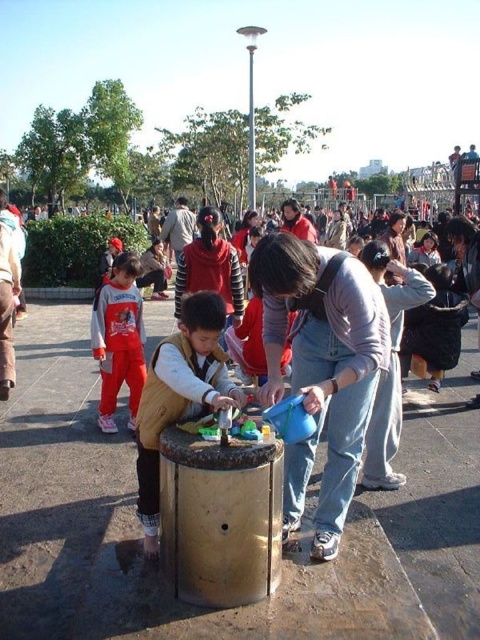
Question: Is matte gray sweater at center to the left of matte black jacket at center from the viewer's perspective?

Choices:
 (A) no
 (B) yes

Answer: (A)

Question: Is light brown vest at center closer to the viewer compared to matte red pants at center?

Choices:
 (A) no
 (B) yes

Answer: (B)

Question: Which point appears farthest from the camera in this image?

Choices:
 (A) click(325, 353)
 (B) click(213, 362)

Answer: (A)

Question: Which object is the closest to the light brown vest at center?

Choices:
 (A) matte black jacket at center
 (B) matte gray sweater at center

Answer: (B)

Question: Can you confirm if matte red pants at center is smaller than matte black jacket at center?

Choices:
 (A) no
 (B) yes

Answer: (B)

Question: Estimate the real-world distances between objects in this image. Which object is closer to the matte red pants at center?

Choices:
 (A) matte black jacket at center
 (B) matte gray sweater at center

Answer: (A)